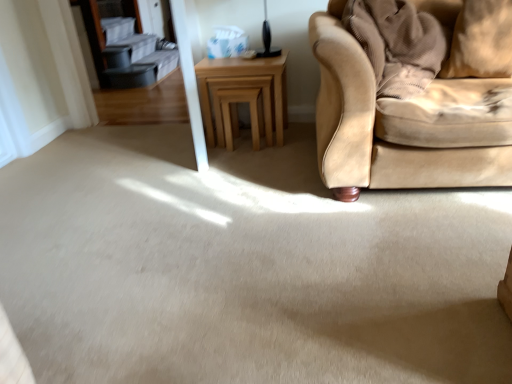
Question: In the image, is light brown wooden stool at center positioned in front of or behind light brown wooden table at center?

Choices:
 (A) behind
 (B) front

Answer: (A)

Question: Do you think light brown wooden stool at center is within light brown wooden table at center, or outside of it?

Choices:
 (A) outside
 (B) inside

Answer: (B)

Question: Which of these objects is positioned farthest from the beige fabric pillow at upper right?

Choices:
 (A) light brown wooden stool at center
 (B) light brown wooden table at center

Answer: (A)

Question: Based on their relative distances, which object is nearer to the light brown wooden table at center?

Choices:
 (A) beige fabric pillow at upper right
 (B) light brown wooden stool at center

Answer: (B)